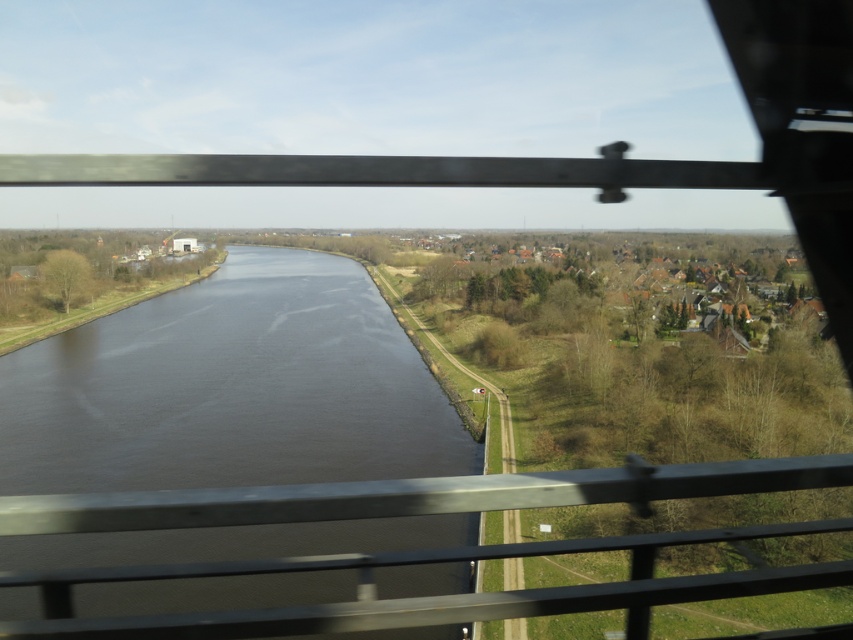
Question: Does dark water at center have a smaller size compared to metallic gray rail at center?

Choices:
 (A) no
 (B) yes

Answer: (A)

Question: Can you confirm if dark water at center is positioned to the left of metallic gray rail at center?

Choices:
 (A) no
 (B) yes

Answer: (B)

Question: Is dark water at center below metallic gray rail at center?

Choices:
 (A) no
 (B) yes

Answer: (A)